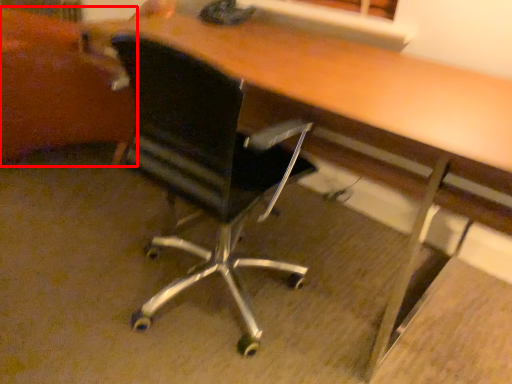
Question: In this image, where is swivel chair (annotated by the red box) located relative to chair?

Choices:
 (A) right
 (B) left

Answer: (B)